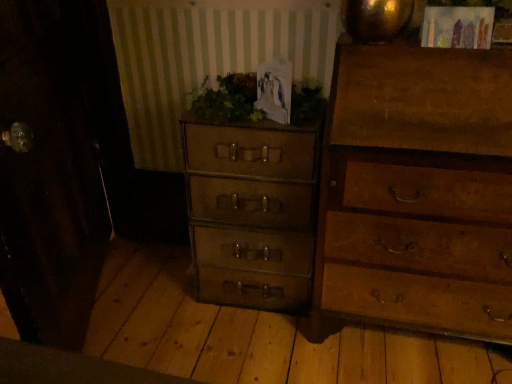
Question: Considering the relative sizes of green leafy plant at center and wooden chest of drawers at right, marked as the 2th chest of drawers in a left-to-right arrangement, in the image provided, is green leafy plant at center shorter than wooden chest of drawers at right, marked as the 2th chest of drawers in a left-to-right arrangement,?

Choices:
 (A) yes
 (B) no

Answer: (A)

Question: Can you confirm if green leafy plant at center is positioned to the right of wooden chest of drawers at right, acting as the 1th chest of drawers starting from the right?

Choices:
 (A) no
 (B) yes

Answer: (A)

Question: Is green leafy plant at center turned away from wooden chest of drawers at right, marked as the 2th chest of drawers in a left-to-right arrangement?

Choices:
 (A) no
 (B) yes

Answer: (A)

Question: Is green leafy plant at center taller than wooden chest of drawers at right, marked as the 2th chest of drawers in a left-to-right arrangement?

Choices:
 (A) no
 (B) yes

Answer: (A)

Question: Is green leafy plant at center located outside wooden chest of drawers at right, marked as the 2th chest of drawers in a left-to-right arrangement?

Choices:
 (A) no
 (B) yes

Answer: (B)

Question: From a real-world perspective, is green leafy plant at center under wooden chest of drawers at right, marked as the 2th chest of drawers in a left-to-right arrangement?

Choices:
 (A) no
 (B) yes

Answer: (A)

Question: Does wooden chest of drawers at right, acting as the 1th chest of drawers starting from the right, turn towards matte brown suitcase at center, the 2th chest of drawers from the right?

Choices:
 (A) no
 (B) yes

Answer: (A)

Question: Is wooden chest of drawers at right, marked as the 2th chest of drawers in a left-to-right arrangement, positioned in front of matte brown suitcase at center, which is the 1th chest of drawers from left to right?

Choices:
 (A) no
 (B) yes

Answer: (B)

Question: From the image's perspective, is wooden chest of drawers at right, acting as the 1th chest of drawers starting from the right, on top of matte brown suitcase at center, the 2th chest of drawers from the right?

Choices:
 (A) no
 (B) yes

Answer: (B)

Question: Is wooden chest of drawers at right, acting as the 1th chest of drawers starting from the right, positioned behind matte brown suitcase at center, which is the 1th chest of drawers from left to right?

Choices:
 (A) yes
 (B) no

Answer: (B)

Question: From the image's perspective, would you say wooden chest of drawers at right, acting as the 1th chest of drawers starting from the right, is shown under matte brown suitcase at center, which is the 1th chest of drawers from left to right?

Choices:
 (A) yes
 (B) no

Answer: (B)

Question: Is wooden chest of drawers at right, acting as the 1th chest of drawers starting from the right, outside matte brown suitcase at center, which is the 1th chest of drawers from left to right?

Choices:
 (A) yes
 (B) no

Answer: (A)

Question: Considering the relative sizes of wooden chest of drawers at right, acting as the 1th chest of drawers starting from the right, and green leafy plant at center in the image provided, is wooden chest of drawers at right, acting as the 1th chest of drawers starting from the right, shorter than green leafy plant at center?

Choices:
 (A) no
 (B) yes

Answer: (A)